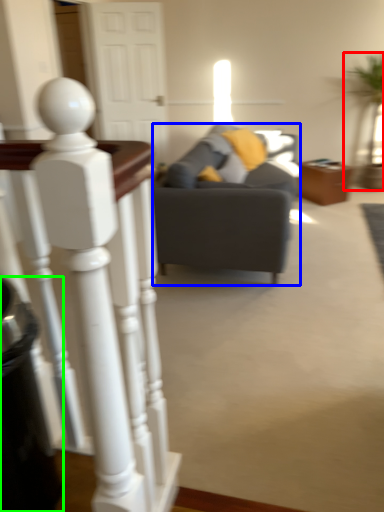
Question: Estimate the real-world distances between objects in this image. Which object is farther from houseplant (highlighted by a red box), studio couch (highlighted by a blue box) or trash bin/can (highlighted by a green box)?

Choices:
 (A) studio couch
 (B) trash bin/can

Answer: (B)